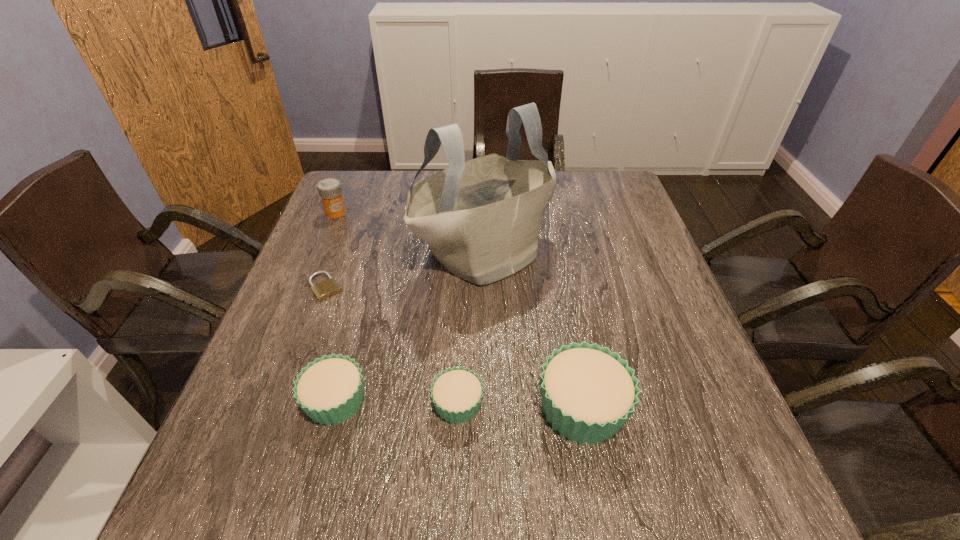
Locate an element on the screen. Image resolution: width=960 pixels, height=540 pixels. blank space located on the left of the tallest cupcake is located at coordinates (467, 408).

Locate an element on the screen. The height and width of the screenshot is (540, 960). free spot located 0.210m on the label side of the farthest object is located at coordinates (313, 267).

Where is `vacant space situated on the front of the shopping bag`? This screenshot has width=960, height=540. vacant space situated on the front of the shopping bag is located at coordinates (487, 365).

Where is `blank space located on the right of the shortest object`? Image resolution: width=960 pixels, height=540 pixels. blank space located on the right of the shortest object is located at coordinates (415, 287).

Where is `object that is at the far edge`? The image size is (960, 540). object that is at the far edge is located at coordinates (329, 189).

This screenshot has height=540, width=960. In order to click on cupcake situated at the left edge in this screenshot , I will do `click(330, 389)`.

The image size is (960, 540). I want to click on medicine present at the left edge, so click(329, 189).

The height and width of the screenshot is (540, 960). Identify the location of padlock positioned at the left edge. (323, 290).

I want to click on object positioned at the far left corner, so click(329, 189).

The width and height of the screenshot is (960, 540). In order to click on object present at the near left corner in this screenshot , I will do `click(330, 389)`.